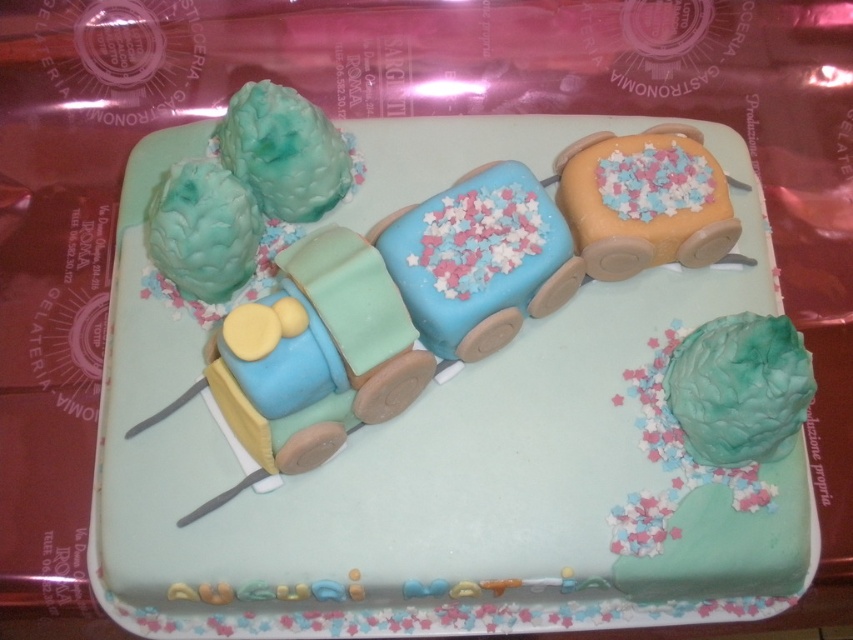
Question: Based on their relative distances, which object is farther from the blue fondant train at center?

Choices:
 (A) matte fondant train at center
 (B) orange frosted train car at upper right

Answer: (A)

Question: Does matte fondant train at center come in front of orange frosted train car at upper right?

Choices:
 (A) yes
 (B) no

Answer: (A)

Question: Estimate the real-world distances between objects in this image. Which object is closer to the orange frosted train car at upper right?

Choices:
 (A) matte fondant train at center
 (B) blue fondant train at center

Answer: (B)

Question: Which object is farther from the camera taking this photo?

Choices:
 (A) orange frosted train car at upper right
 (B) blue fondant train at center
 (C) matte fondant train at center

Answer: (A)

Question: Considering the relative positions of blue fondant train at center and orange frosted train car at upper right in the image provided, where is blue fondant train at center located with respect to orange frosted train car at upper right?

Choices:
 (A) left
 (B) right

Answer: (A)

Question: Does matte fondant train at center come behind blue fondant train at center?

Choices:
 (A) yes
 (B) no

Answer: (B)